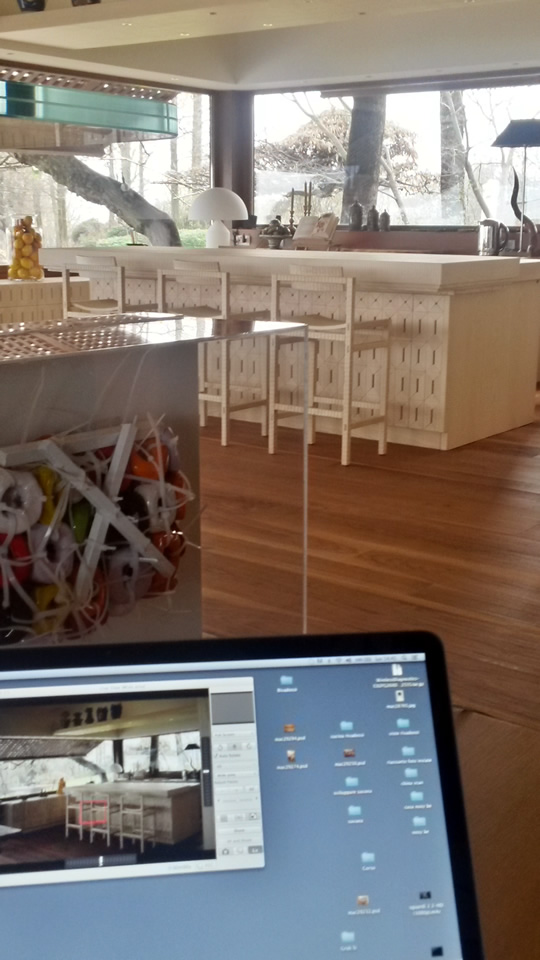
You are a GUI agent. You are given a task and a screenshot of the screen. Output one action in this format:
    pyautogui.click(x=<x>, y=<y>)
    Task: Click on the space under the chairs
    
    Given the screenshot: What is the action you would take?
    pyautogui.click(x=322, y=446), pyautogui.click(x=243, y=427)